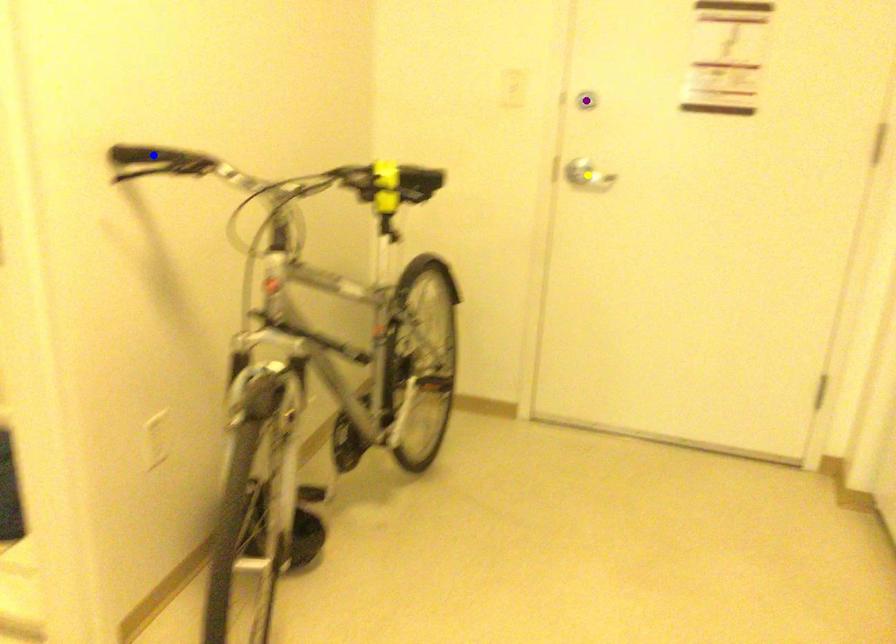
Order these from nearest to farthest:
A) blue point
B) yellow point
C) purple point

1. blue point
2. purple point
3. yellow point